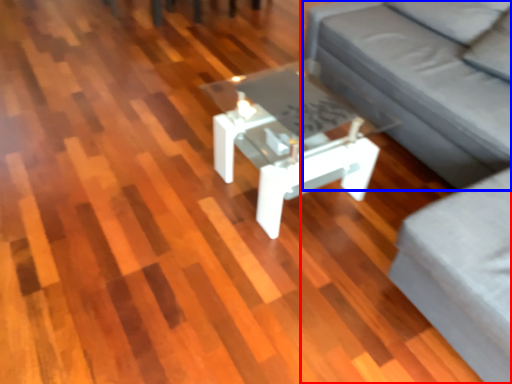
Question: Among these objects, which one is nearest to the camera, studio couch (highlighted by a red box) or couch (highlighted by a blue box)?

Choices:
 (A) studio couch
 (B) couch

Answer: (A)